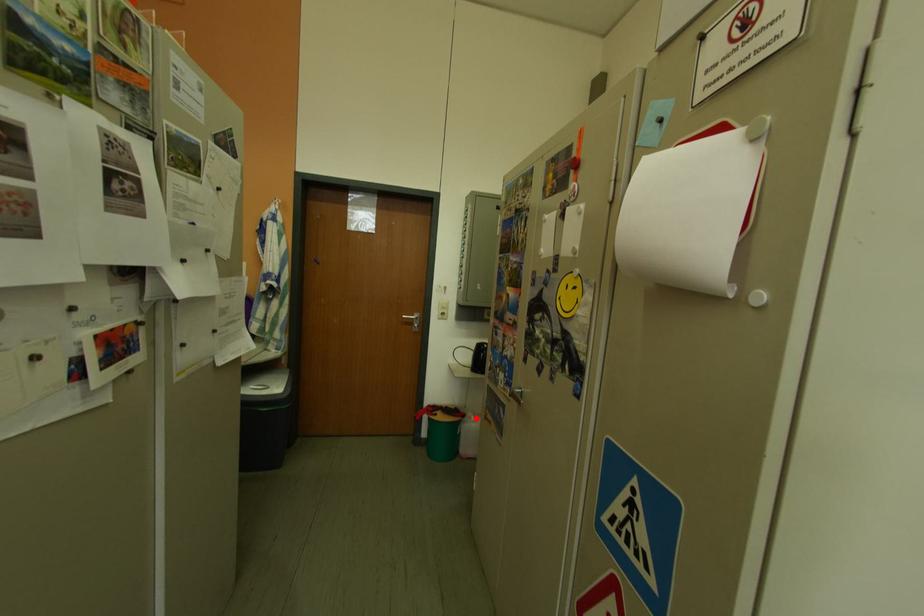
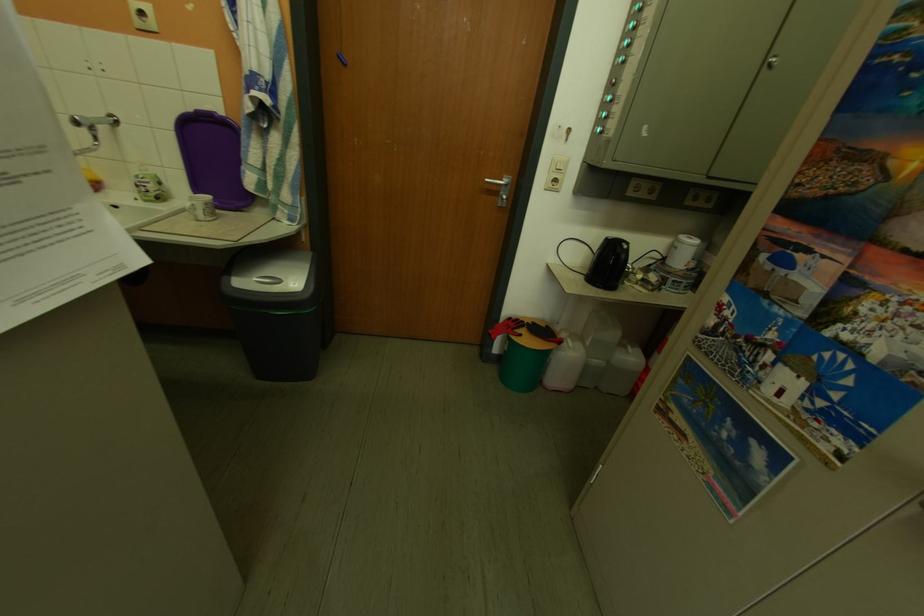
Question: I am providing you with two images of the same scene from different viewpoints. A red point is shown in image1. For the corresponding object point in image2, is it positioned nearer or farther from the camera?

Choices:
 (A) Nearer
 (B) Farther

Answer: (A)